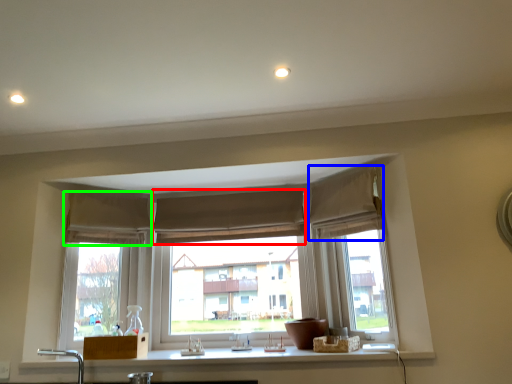
Question: Which object is positioned closest to curtain (highlighted by a red box)? Select from curtain (highlighted by a blue box) and curtain (highlighted by a green box).

Choices:
 (A) curtain
 (B) curtain

Answer: (B)